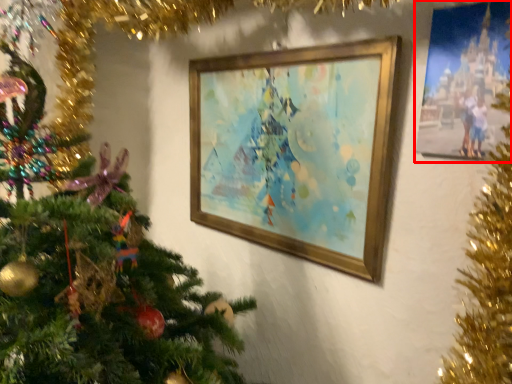
Question: From the image's perspective, considering the relative positions of picture frame (annotated by the red box) and picture frame in the image provided, where is picture frame (annotated by the red box) located with respect to the staircase?

Choices:
 (A) above
 (B) below

Answer: (A)